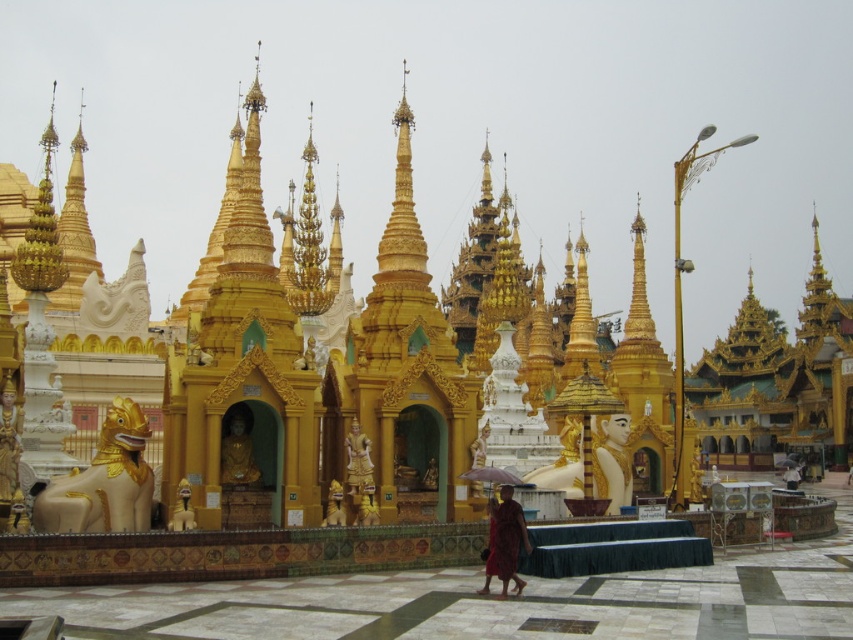
Is red monk at center further to the viewer compared to golden polished statue at lower left?

No, it is not.

Is point (502, 493) more distant than point (7, 448)?

No, it is not.

Between point (517, 586) and point (7, 504), which one is positioned behind?

The point (7, 504) is behind.

Identify the location of red monk at center. (505, 541).

Is red monk at center taller than gold polished statue at center?

Yes.

Between point (490, 563) and point (363, 440), which one is positioned behind?

The point (363, 440) is more distant.

I want to click on red monk at center, so click(x=505, y=541).

Can you confirm if gold leaf statue at center is positioned below gold polished statue at center?

Yes.

Image resolution: width=853 pixels, height=640 pixels. Describe the element at coordinates (612, 461) in the screenshot. I see `gold leaf statue at center` at that location.

At what (x,y) coordinates should I click in order to perform the action: click on gold leaf statue at center. Please return your answer as a coordinate pair (x, y). The width and height of the screenshot is (853, 640). Looking at the image, I should click on [x=612, y=461].